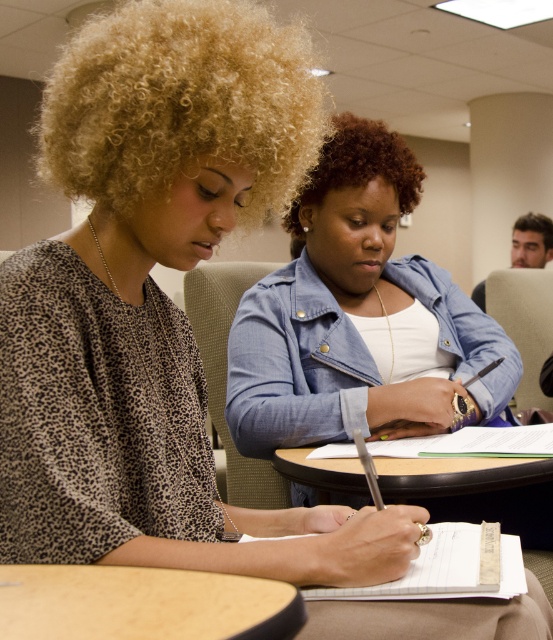
Question: Which object appears farthest from the camera in this image?

Choices:
 (A) wooden table at lower left
 (B) leopard print blouse at center

Answer: (B)

Question: From the image, what is the correct spatial relationship of leopard print blouse at center in relation to blue denim jacket at center?

Choices:
 (A) above
 (B) below

Answer: (B)

Question: Considering the real-world distances, which object is closest to the white lined paper at lower center?

Choices:
 (A) blue denim jacket at center
 (B) leopard print blouse at center
 (C) wooden table at lower left

Answer: (C)

Question: Which object appears closest to the camera in this image?

Choices:
 (A) leopard print blouse at center
 (B) wooden table at lower left

Answer: (B)

Question: Considering the relative positions of wooden table at lower left and white lined paper at lower center in the image provided, where is wooden table at lower left located with respect to white lined paper at lower center?

Choices:
 (A) below
 (B) above

Answer: (B)

Question: Does leopard print blouse at center have a larger size compared to blue denim jacket at center?

Choices:
 (A) yes
 (B) no

Answer: (B)